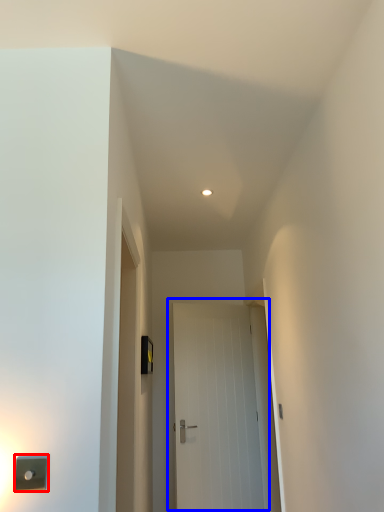
Question: Which point is closer to the camera, light switch (highlighted by a red box) or door (highlighted by a blue box)?

Choices:
 (A) light switch
 (B) door

Answer: (A)